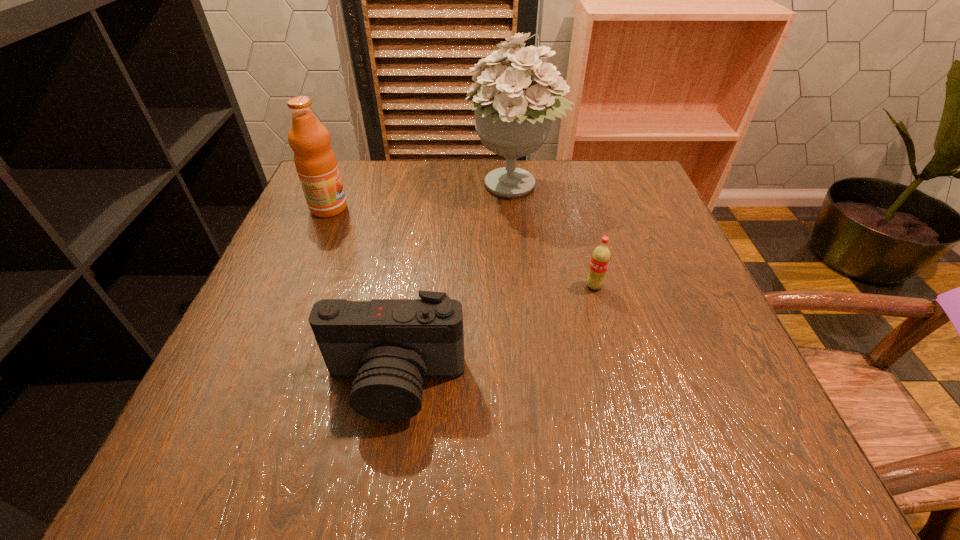
At what (x,y) coordinates should I click in order to perform the action: click on bouquet that is positioned at the far edge. Please return your answer as a coordinate pair (x, y). The height and width of the screenshot is (540, 960). Looking at the image, I should click on pos(513,115).

This screenshot has width=960, height=540. Identify the location of fruit juice that is at the far edge. (316, 164).

Where is `object that is at the near edge`? object that is at the near edge is located at coordinates (388, 345).

At what (x,y) coordinates should I click in order to perform the action: click on object positioned at the left edge. Please return your answer as a coordinate pair (x, y). Image resolution: width=960 pixels, height=540 pixels. Looking at the image, I should click on (316, 164).

Where is `object at the far left corner`? The image size is (960, 540). object at the far left corner is located at coordinates point(316,164).

In order to click on free space at the far edge of the desktop in this screenshot , I will do `click(402, 209)`.

Find the location of `vacant space at the near edge of the desktop`. vacant space at the near edge of the desktop is located at coordinates (498, 455).

Locate an element on the screen. The width and height of the screenshot is (960, 540). free space at the left edge of the desktop is located at coordinates (312, 356).

I want to click on vacant area at the right edge, so click(653, 332).

The width and height of the screenshot is (960, 540). In the image, there is a desktop. Identify the location of vacant space at the far left corner. (345, 166).